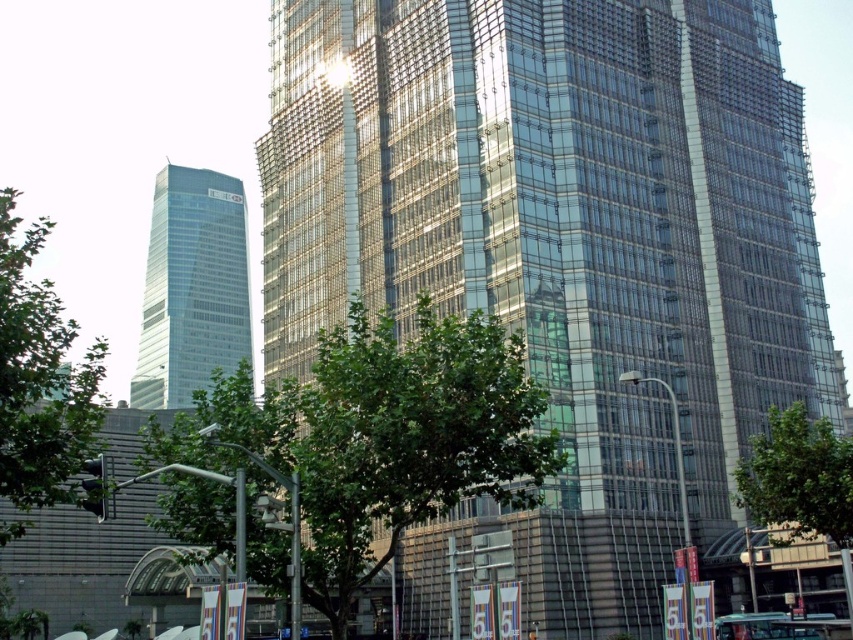
You are standing at the origin point of the coordinate system in the urban landscape. You need to locate the transparent glass building at center. What are its coordinates?

The transparent glass building at center is located at coordinates point (561, 230).

You are standing in the urban landscape and want to take a photo of both green leafy tree at center and green leafy tree at lower right. Which tree should you position yourself closer to the left side of to ensure both are in the frame?

You should position yourself closer to the left side of the green leafy tree at center since it is to the left of the green leafy tree at lower right, allowing both trees to be captured in the photo frame.